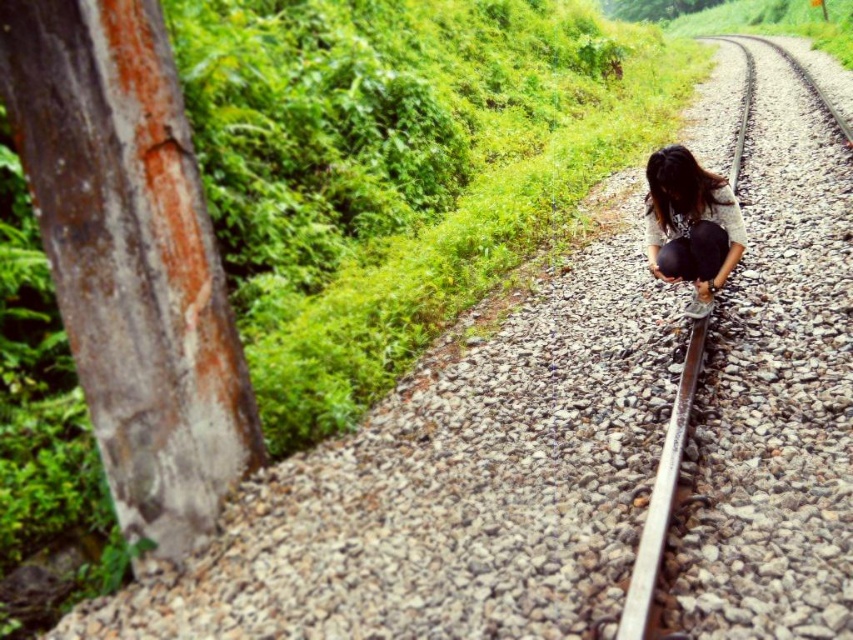
Does matte black bag at center appear under rusty metal train track at center-right?

Actually, matte black bag at center is above rusty metal train track at center-right.

Is matte black bag at center above rusty metal train track at center-right?

Correct, matte black bag at center is located above rusty metal train track at center-right.

Describe the element at coordinates (689, 225) in the screenshot. I see `matte black bag at center` at that location.

Identify the location of matte black bag at center. (689, 225).

Find the location of a particular element. metal train track at center is located at coordinates (660, 497).

Does metal train track at center have a lesser width compared to rusty metal train track at center-right?

No, metal train track at center is not thinner than rusty metal train track at center-right.

This screenshot has width=853, height=640. Find the location of `metal train track at center`. metal train track at center is located at coordinates (660, 497).

Where is `metal train track at center`? This screenshot has height=640, width=853. metal train track at center is located at coordinates (660, 497).

Which is above, matte black bag at center or metal train track at center?

metal train track at center

This screenshot has height=640, width=853. Find the location of `matte black bag at center`. matte black bag at center is located at coordinates (689, 225).

Which is in front, point (662, 250) or point (730, 248)?

Point (730, 248) is more forward.

Locate an element on the screen. Image resolution: width=853 pixels, height=640 pixels. matte black bag at center is located at coordinates (689, 225).